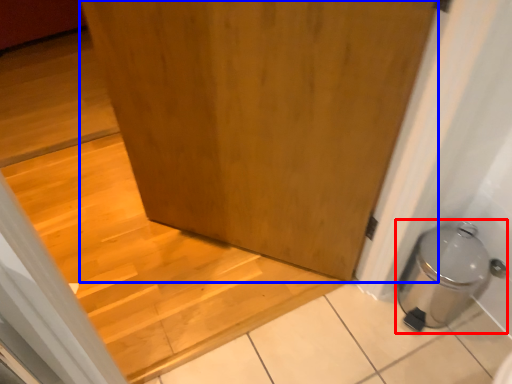
Question: Which object is closer to the camera taking this photo, water heater (highlighted by a red box) or door (highlighted by a blue box)?

Choices:
 (A) water heater
 (B) door

Answer: (B)